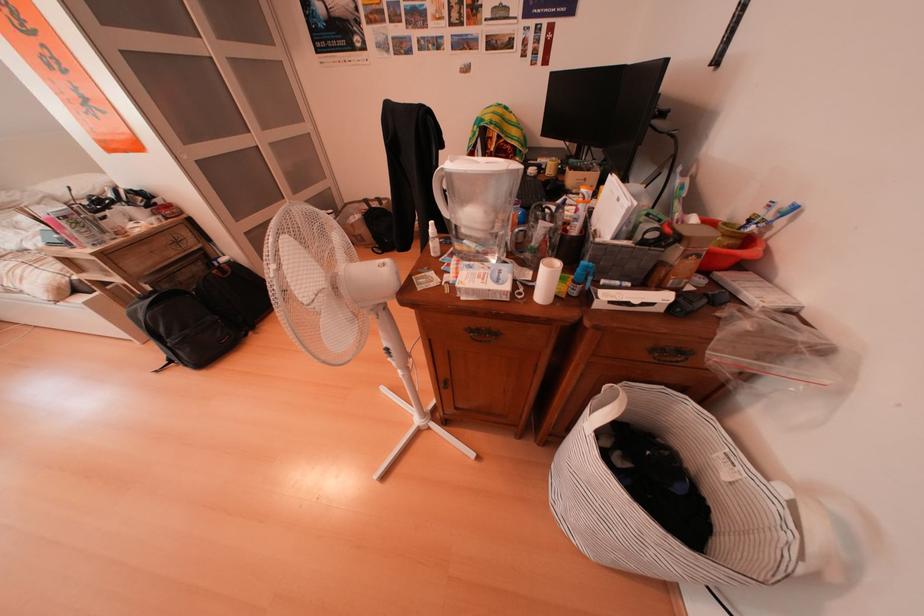
This screenshot has width=924, height=616. I want to click on black backpack handle, so click(x=202, y=315).